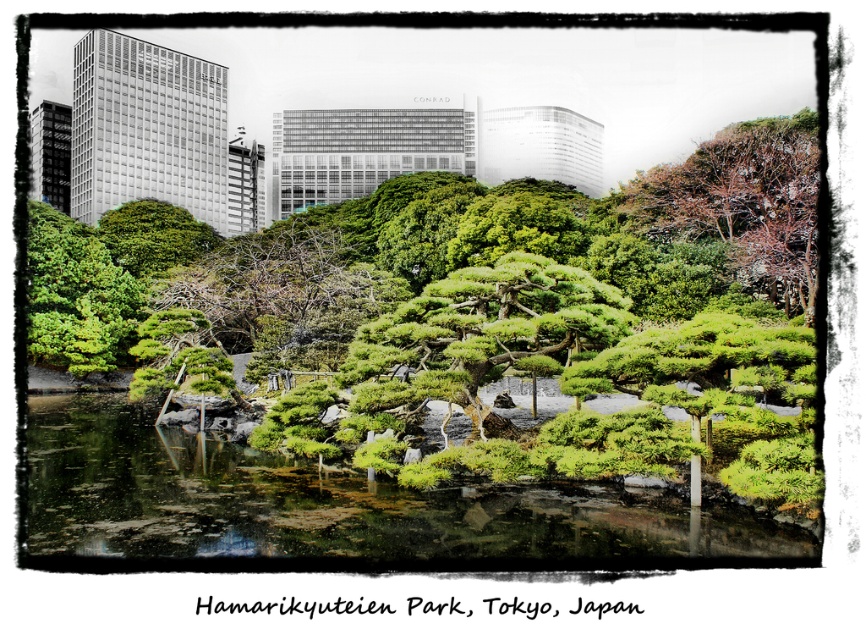
You are a visitor at Hamarikyuteien Park and want to take a photo of both the green textured tree at center and the brown textured tree at upper right. From your current position, which tree should you aim your camera at first to include both in the frame?

You should aim your camera at the green textured tree at center first because it is positioned below the brown textured tree at upper right, so adjusting the frame to include both would require starting from the lower tree and expanding upwards.

You are standing in Hamarikyuteien Park and want to take a photo of the green textured bonsai tree at center and the green textured tree at center. Which one should you focus on first if you want both to be in sharp focus?

To have both the green textured bonsai tree at center and the green textured tree at center in sharp focus, you should focus on the green textured tree at center since it is farther away from the viewer. This ensures the depth of field includes both the closer bonsai tree and the farther tree.